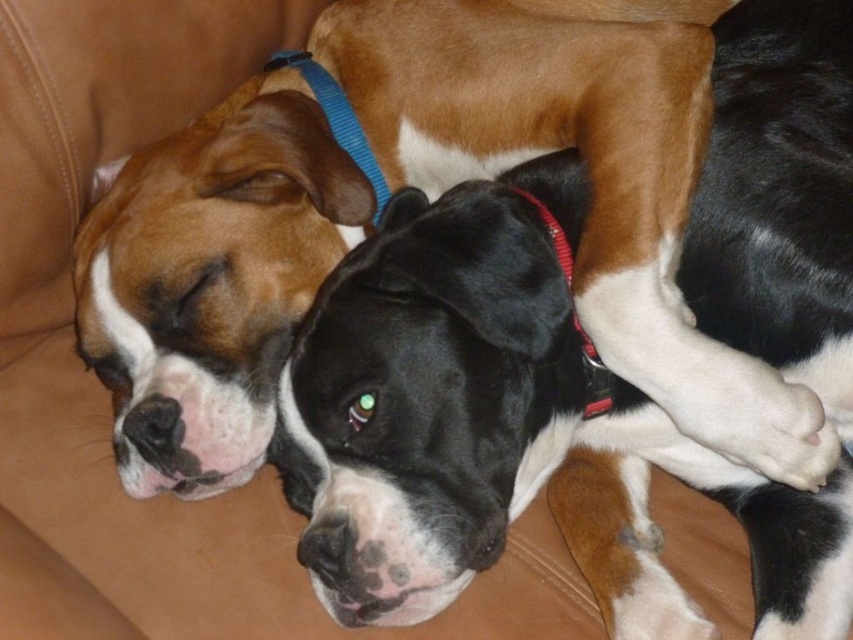
Question: Does black glossy dog at center have a smaller size compared to blue fabric neckband at upper center?

Choices:
 (A) no
 (B) yes

Answer: (A)

Question: Is black glossy dog at center closer to the viewer compared to blue fabric neckband at upper center?

Choices:
 (A) no
 (B) yes

Answer: (B)

Question: Which point is closer to the camera?

Choices:
 (A) click(279, 56)
 (B) click(558, 394)
 (C) click(656, 234)
 (D) click(560, 236)

Answer: (C)

Question: Does matte black dog at center appear over red fabric collar at center?

Choices:
 (A) yes
 (B) no

Answer: (A)

Question: Which point is closer to the camera taking this photo?

Choices:
 (A) (480, 470)
 (B) (566, 276)
 (C) (380, 179)
 (D) (506, 161)

Answer: (A)

Question: Based on their relative distances, which object is nearer to the blue fabric neckband at upper center?

Choices:
 (A) red fabric collar at center
 (B) matte black dog at center
 (C) black glossy dog at center

Answer: (B)